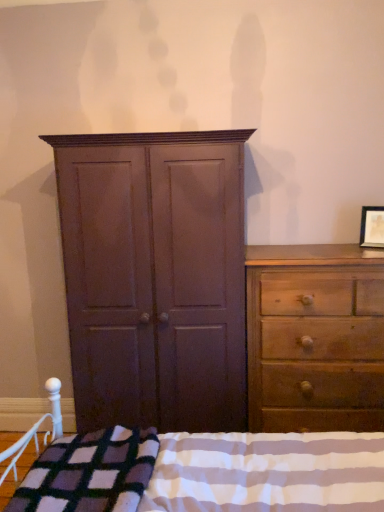
Question: Is matte brown cupboard at center facing away from matte wooden picture frame at upper right?

Choices:
 (A) yes
 (B) no

Answer: (B)

Question: From a real-world perspective, is matte brown cupboard at center under matte wooden picture frame at upper right?

Choices:
 (A) no
 (B) yes

Answer: (B)

Question: Can you confirm if matte brown cupboard at center is taller than matte wooden picture frame at upper right?

Choices:
 (A) yes
 (B) no

Answer: (A)

Question: Is the position of matte brown cupboard at center more distant than that of matte wooden picture frame at upper right?

Choices:
 (A) yes
 (B) no

Answer: (B)

Question: Considering the relative positions of matte brown cupboard at center and matte wooden picture frame at upper right in the image provided, is matte brown cupboard at center to the right of matte wooden picture frame at upper right from the viewer's perspective?

Choices:
 (A) no
 (B) yes

Answer: (A)

Question: Are matte brown cupboard at center and matte wooden picture frame at upper right beside each other?

Choices:
 (A) yes
 (B) no

Answer: (B)

Question: Is the surface of wooden dresser at right in direct contact with matte brown cupboard at center?

Choices:
 (A) no
 (B) yes

Answer: (A)

Question: Can you confirm if wooden dresser at right is bigger than matte brown cupboard at center?

Choices:
 (A) no
 (B) yes

Answer: (A)

Question: Is wooden dresser at right not near matte brown cupboard at center?

Choices:
 (A) yes
 (B) no

Answer: (B)

Question: From a real-world perspective, is wooden dresser at right under matte brown cupboard at center?

Choices:
 (A) no
 (B) yes

Answer: (B)

Question: Is wooden dresser at right to the left of matte brown cupboard at center from the viewer's perspective?

Choices:
 (A) no
 (B) yes

Answer: (A)

Question: Is wooden dresser at right to the right of matte brown cupboard at center from the viewer's perspective?

Choices:
 (A) no
 (B) yes

Answer: (B)

Question: Is wooden dresser at right to the right of plaid wool blanket at lower center from the viewer's perspective?

Choices:
 (A) no
 (B) yes

Answer: (B)